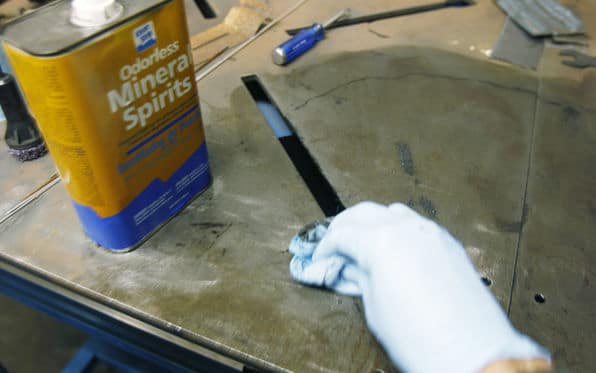
In order to click on dirty rag in this screenshot , I will do `click(302, 244)`.